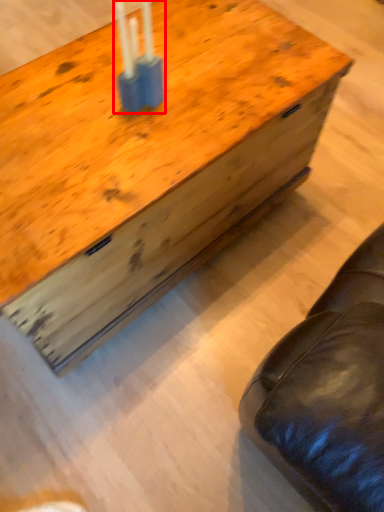
Question: From the image's perspective, what is the correct spatial positioning of candle holder (annotated by the red box) in reference to table?

Choices:
 (A) below
 (B) above

Answer: (B)